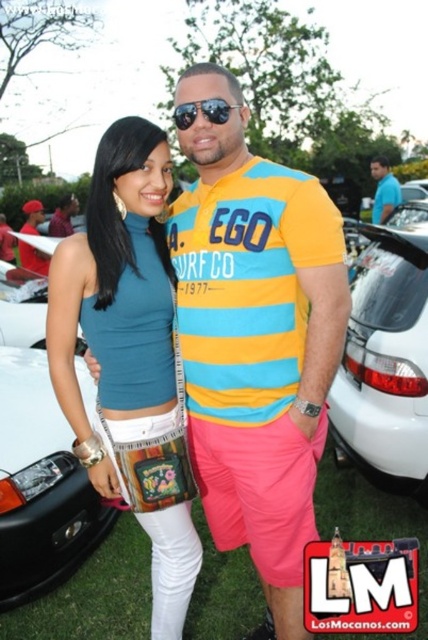
Based on the scene description, can you determine which object is taller between the white matte car at right and the matte black shirt at center?

The white matte car at right is much taller than the matte black shirt at center.

Please provide the coordinates of the teal matte tank top at center in the image. The coordinate system is normalized, meaning the origin is at the bottom left corner of the image, and the values range from 0 to 1 in both x and y directions. The x increases to the right, and y increases upward. The coordinates are given as a tuple of two decimal numbers separated by a comma. For example, if the object is at the center, it would be written as 0.5,0.5. Please answer with only the coordinates in the specified.

[130,356]